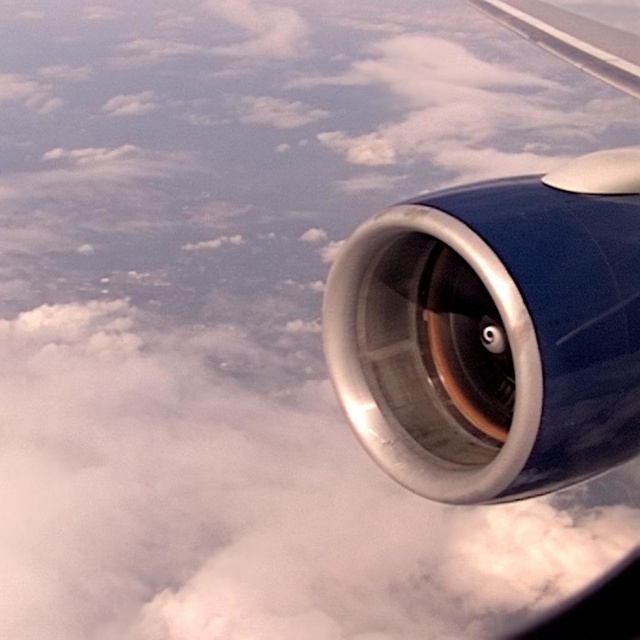
Who is taller, blue metallic engine at right or metallic silver wing at upper right?

Standing taller between the two is metallic silver wing at upper right.

Measure the distance between blue metallic engine at right and camera.

A distance of 3.36 feet exists between blue metallic engine at right and camera.

Which is behind, point (554, 380) or point (621, 83)?

Positioned behind is point (621, 83).

The image size is (640, 640). I want to click on blue metallic engine at right, so click(500, 328).